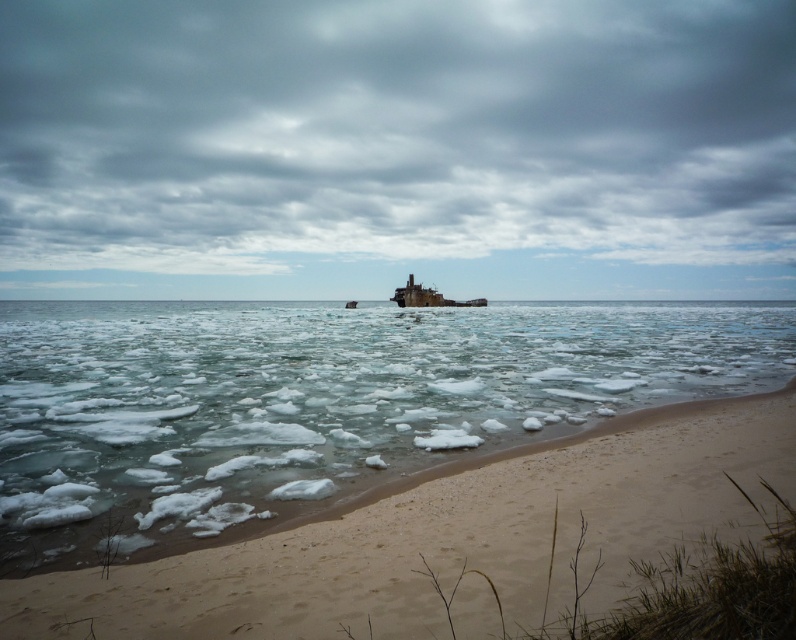
You are a marine biologist studying the shipwreck. You notice the translucent ice at center and the rusty metal shipwreck at center. Based on their positions, which object is more likely to block your path when approaching the shipwreck from the water surface?

The translucent ice at center is wider than the rusty metal shipwreck at center, so it is more likely to block your path when approaching the shipwreck from the water surface.

From the picture: You are an observer on the beach looking towards the water. Which object, the cloudy sky at upper center or the translucent ice at center, spans a greater horizontal distance across the scene?

The cloudy sky at upper center spans a greater horizontal distance across the scene than the translucent ice at center because its width surpasses that of the translucent ice at center.

You are standing on the beach and see the translucent ice at center and the rusty metal shipwreck at center. Which object is nearer to you?

The translucent ice at center is closer to the viewer than the rusty metal shipwreck at center.